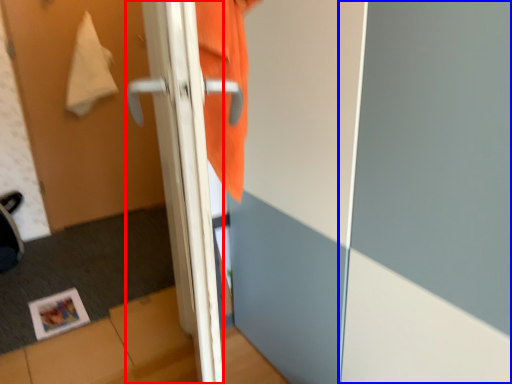
Question: Which point is closer to the camera, door (highlighted by a red box) or screen door (highlighted by a blue box)?

Choices:
 (A) door
 (B) screen door

Answer: (A)